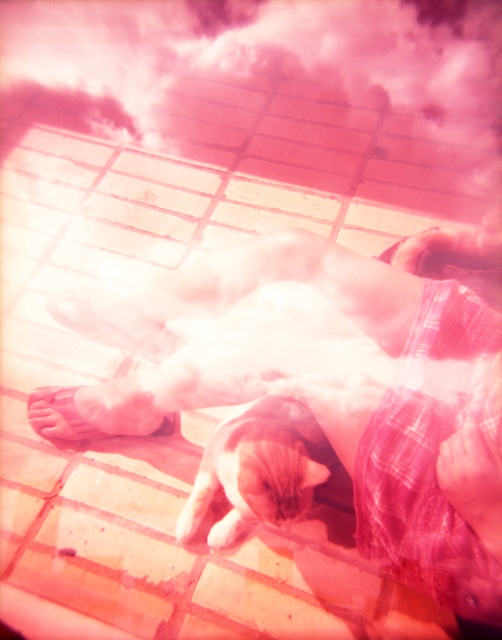
You are a delivery robot trying to navigate to the pink matte sandal at lower left. There is a soft fur cat at center in the way. Can you go around the cat without getting too close? The robot has a 20 cm safety radius requirement.

The distance between the soft fur cat at center and the pink matte sandal at lower left is 28.38 centimeters. Since the robot requires a 20 cm safety radius, it can safely navigate around the cat as the existing distance allows enough space to maneuver without violating the safety requirement.

From the picture: You are standing at the edge of the tiled patio and want to place a new potted plant exactly where the soft fur cat at center is currently located. What coordinates should you use for the plant?

You should place the potted plant at coordinates (257, 468), which is where the soft fur cat at center is located.

Looking at this image, you are standing at the origin point of the image coordinate system. The pink matte sandal at lower left is located at coordinates point (94, 410). If you want to walk straight towards the pink matte sandal at lower left, which direction should you move? Please answer with either north, south, east, or west.

The pink matte sandal at lower left is located at coordinates point (94, 410). In the image coordinate system, lower left corresponds to the direction of west and south. Therefore, to move towards it from the origin, you should head southwest.